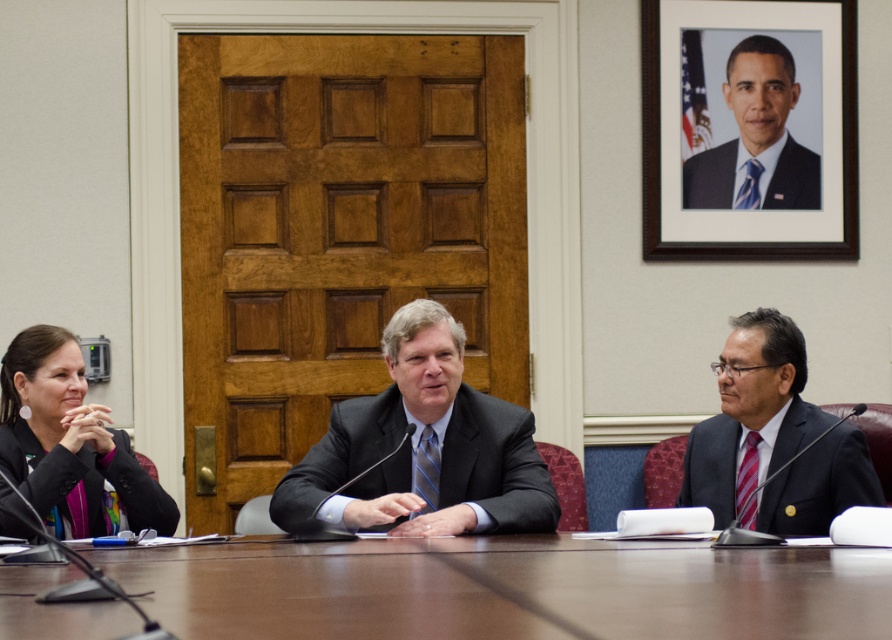
Question: Which point appears closest to the camera in this image?

Choices:
 (A) (838, 156)
 (B) (307, 492)
 (C) (731, 67)
 (D) (716, 422)

Answer: (B)

Question: Can you confirm if brown wooden table at center is positioned below matte black suit at right?

Choices:
 (A) no
 (B) yes

Answer: (B)

Question: Which object appears closest to the camera in this image?

Choices:
 (A) matte black suit at right
 (B) brown wooden table at center
 (C) matte black jacket at left

Answer: (B)

Question: Is matte black jacket at left to the left of blue tie at upper right from the viewer's perspective?

Choices:
 (A) yes
 (B) no

Answer: (A)

Question: Does matte black suit at center lie behind matte black suit at right?

Choices:
 (A) yes
 (B) no

Answer: (B)

Question: Which point is farther to the camera?

Choices:
 (A) matte black suit at center
 (B) matte black suit at right
 (C) blue tie at upper right
 (D) brown wooden table at center

Answer: (C)